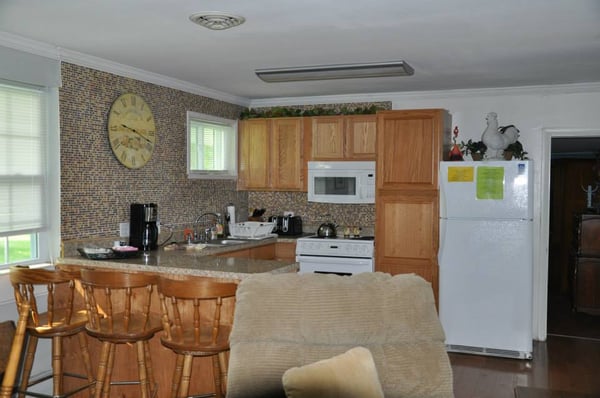
This screenshot has width=600, height=398. What are the coordinates of `stove` in the screenshot? It's located at (348, 258).